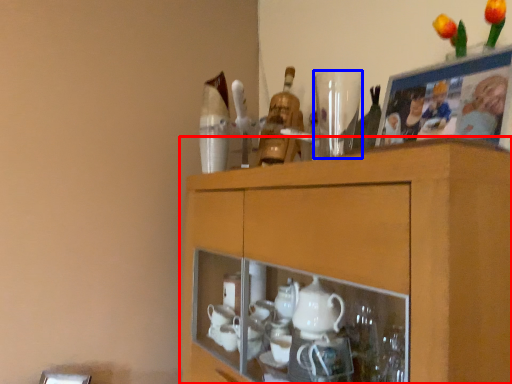
Question: Among these objects, which one is farthest to the camera, cabinetry (highlighted by a red box) or tableware (highlighted by a blue box)?

Choices:
 (A) cabinetry
 (B) tableware

Answer: (B)